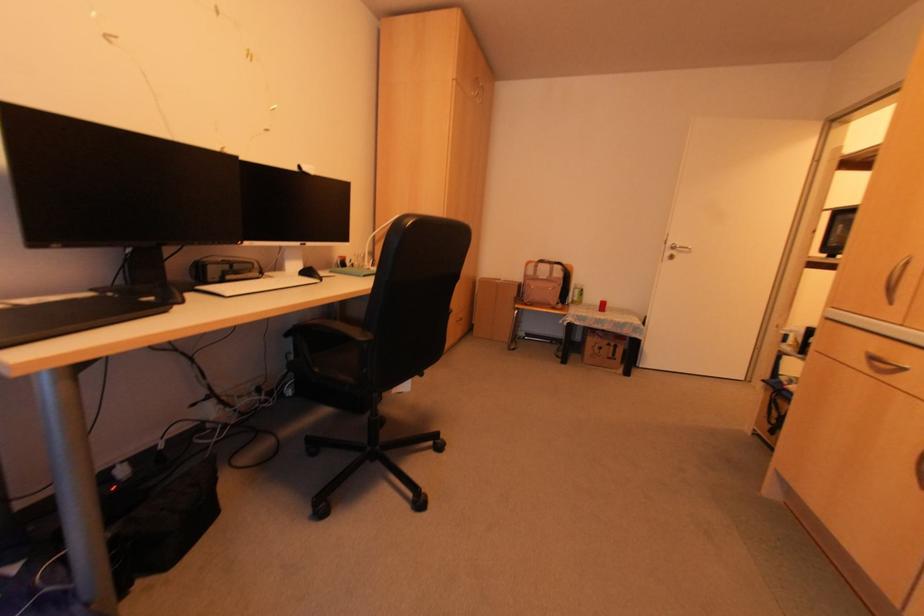
Find where to pull the silver drawer handle. Please return your answer as a coordinate pair (x, y).

(882, 363)